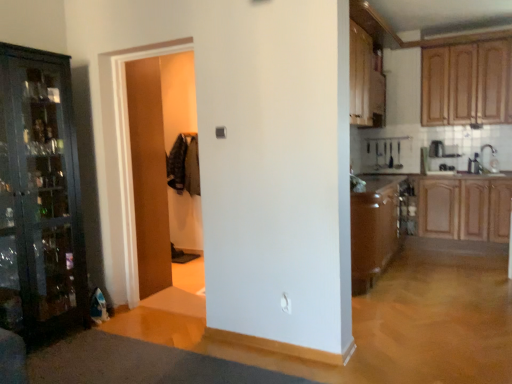
Question: Does wooden door at center have a greater height compared to wooden cabinet at right, which is counted as the 3th cabinetry, starting from the top?

Choices:
 (A) yes
 (B) no

Answer: (A)

Question: Considering the relative positions of wooden door at center and wooden cabinet at right, marked as the first cabinetry in a bottom-to-top arrangement, in the image provided, is wooden door at center behind wooden cabinet at right, marked as the first cabinetry in a bottom-to-top arrangement,?

Choices:
 (A) no
 (B) yes

Answer: (A)

Question: Considering the relative sizes of wooden door at center and wooden cabinet at right, marked as the first cabinetry in a bottom-to-top arrangement, in the image provided, is wooden door at center wider than wooden cabinet at right, marked as the first cabinetry in a bottom-to-top arrangement,?

Choices:
 (A) yes
 (B) no

Answer: (B)

Question: From the image's perspective, does wooden door at center appear lower than wooden cabinet at right, which is counted as the 3th cabinetry, starting from the top?

Choices:
 (A) yes
 (B) no

Answer: (B)

Question: Is wooden door at center oriented away from wooden cabinet at right, which is counted as the 3th cabinetry, starting from the top?

Choices:
 (A) yes
 (B) no

Answer: (B)

Question: Is wooden door at center aimed at wooden cabinet at right, which is counted as the 3th cabinetry, starting from the top?

Choices:
 (A) no
 (B) yes

Answer: (A)

Question: From the image's perspective, does wooden cabinet at right, which is counted as the 3th cabinetry, starting from the top, appear lower than brown laminate counter top at center?

Choices:
 (A) no
 (B) yes

Answer: (B)

Question: Is brown laminate counter top at center at the back of wooden cabinet at right, which is counted as the 3th cabinetry, starting from the top?

Choices:
 (A) no
 (B) yes

Answer: (A)

Question: Considering the relative sizes of wooden cabinet at right, marked as the first cabinetry in a bottom-to-top arrangement, and brown laminate counter top at center in the image provided, is wooden cabinet at right, marked as the first cabinetry in a bottom-to-top arrangement, bigger than brown laminate counter top at center?

Choices:
 (A) yes
 (B) no

Answer: (A)

Question: Is wooden cabinet at right, marked as the first cabinetry in a bottom-to-top arrangement, shorter than brown laminate counter top at center?

Choices:
 (A) no
 (B) yes

Answer: (A)

Question: Is wooden cabinet at right, which is counted as the 3th cabinetry, starting from the top, closer to the viewer compared to brown laminate counter top at center?

Choices:
 (A) yes
 (B) no

Answer: (B)

Question: Can you confirm if wooden cabinet at right, marked as the first cabinetry in a bottom-to-top arrangement, is positioned to the left of brown laminate counter top at center?

Choices:
 (A) yes
 (B) no

Answer: (B)

Question: Is white glossy sink at right to the right of wooden cabinet at upper right, marked as the second cabinetry in a bottom-to-top arrangement, from the viewer's perspective?

Choices:
 (A) yes
 (B) no

Answer: (A)